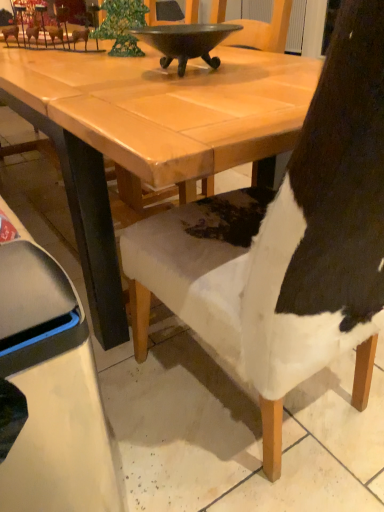
Question: Is white fur chair at center, marked as the second chair in a left-to-right arrangement, taller or shorter than white fabric chair at lower right, the 1th chair when ordered from left to right?

Choices:
 (A) tall
 (B) short

Answer: (A)

Question: Is white fur chair at center, arranged as the 1th chair when viewed from the right, in front of or behind white fabric chair at lower right, the 1th chair when ordered from left to right, in the image?

Choices:
 (A) behind
 (B) front

Answer: (A)

Question: Based on their relative distances, which object is farther from the white fur chair at center, arranged as the 1th chair when viewed from the right?

Choices:
 (A) shiny dark metal bowl at upper center
 (B) white fabric chair at lower right, the 1th chair when ordered from left to right

Answer: (A)

Question: Which object is the closest to the white fur chair at center, arranged as the 1th chair when viewed from the right?

Choices:
 (A) shiny dark metal bowl at upper center
 (B) white fabric chair at lower right, acting as the 2th chair starting from the right

Answer: (B)